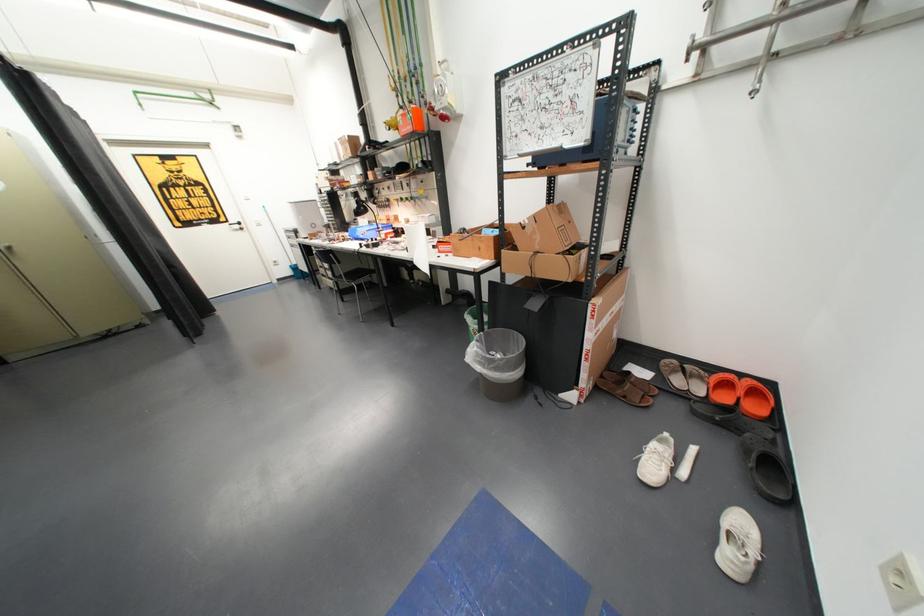
This screenshot has height=616, width=924. What are the coordinates of `blue mop handle` in the screenshot? It's located at (286, 246).